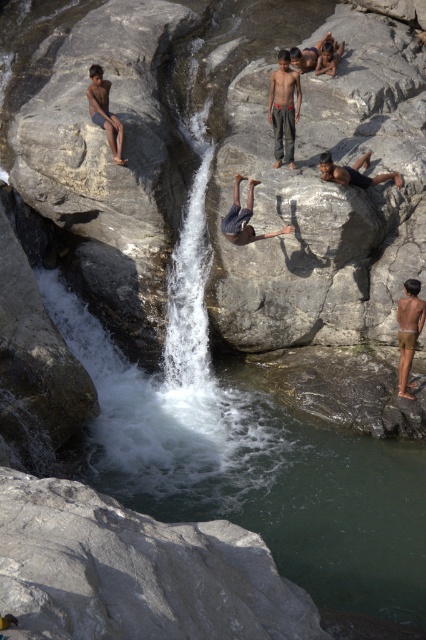
Question: Can you confirm if dark blue fabric at center is smaller than brown skin man at upper center?

Choices:
 (A) yes
 (B) no

Answer: (B)

Question: Which of the following is the farthest from the observer?

Choices:
 (A) (196, 588)
 (B) (370, 150)
 (C) (279, 157)
 (D) (91, 109)

Answer: (D)

Question: Estimate the real-world distances between objects in this image. Which object is farther from the smooth skin man at upper center?

Choices:
 (A) brown skin boy at center
 (B) dark blue fabric at center
 (C) brown skin man at upper left
 (D) brown skin man at upper center

Answer: (B)

Question: Can you confirm if brown skin boy at center is positioned to the right of smooth skin man at upper center?

Choices:
 (A) yes
 (B) no

Answer: (B)

Question: Estimate the real-world distances between objects in this image. Which object is farther from the smooth skin man at upper center?

Choices:
 (A) brown skin boy at center
 (B) gray rough rock at lower left
 (C) brown skin man at upper left

Answer: (B)

Question: Can you confirm if gray rough rock at lower left is positioned to the right of brown skin man at upper left?

Choices:
 (A) yes
 (B) no

Answer: (A)